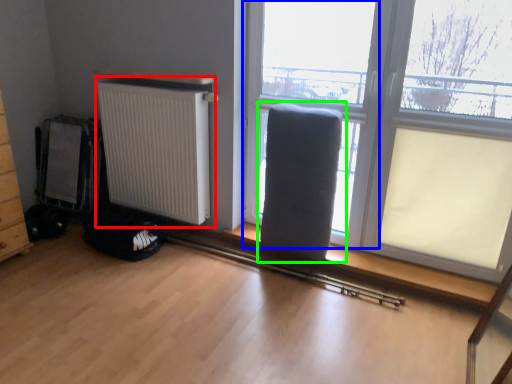
Question: Estimate the real-world distances between objects in this image. Which object is closer to radiator (highlighted by a red box), window frame (highlighted by a blue box) or armchair (highlighted by a green box)?

Choices:
 (A) window frame
 (B) armchair

Answer: (A)